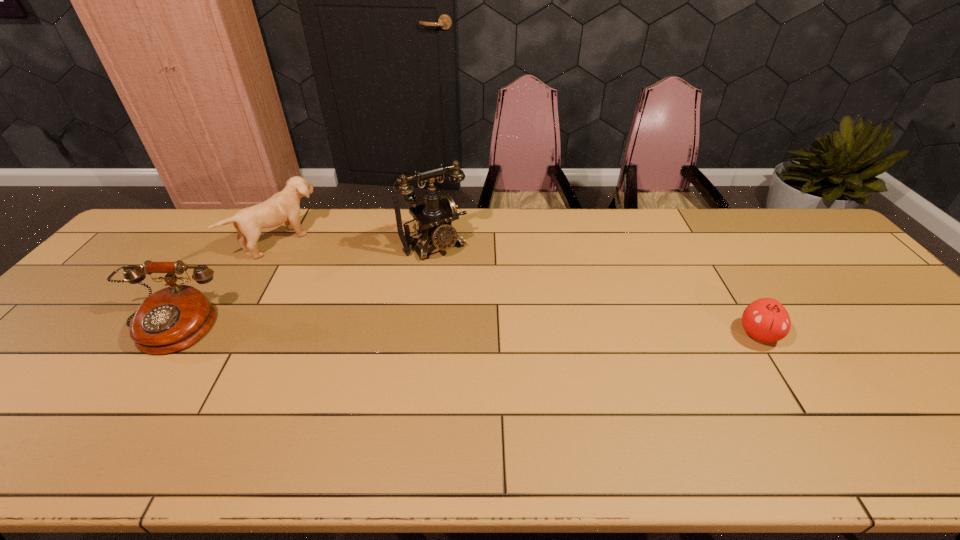
This screenshot has width=960, height=540. Find the location of `the shorter telephone`. the shorter telephone is located at coordinates (174, 318).

Where is `the nearer telephone`? Image resolution: width=960 pixels, height=540 pixels. the nearer telephone is located at coordinates (174, 318).

This screenshot has height=540, width=960. Find the location of `the shortest object`. the shortest object is located at coordinates (766, 319).

Locate an element on the screen. the rightmost object is located at coordinates (766, 319).

The height and width of the screenshot is (540, 960). In order to click on the third object from left to right in this screenshot , I will do `click(435, 217)`.

Identify the location of the taller telephone. This screenshot has width=960, height=540. 435,217.

Locate an element on the screen. The height and width of the screenshot is (540, 960). puppy is located at coordinates (283, 207).

This screenshot has height=540, width=960. I want to click on free space located 0.050m on the dial of the shorter telephone, so click(135, 373).

At what (x,y) coordinates should I click in order to perform the action: click on free space located 0.230m on the right of the shortest object. Please return your answer as a coordinate pair (x, y). Looking at the image, I should click on (870, 334).

The width and height of the screenshot is (960, 540). Find the location of `vacant point located 0.390m on the rotary dial of the right telephone`. vacant point located 0.390m on the rotary dial of the right telephone is located at coordinates (521, 345).